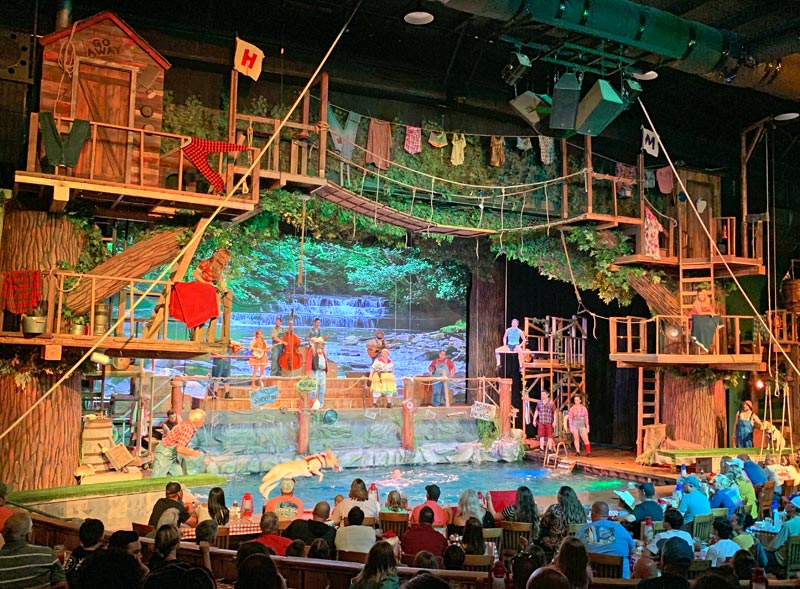
Image resolution: width=800 pixels, height=589 pixels. I want to click on table, so click(236, 524), click(634, 559), click(614, 509).